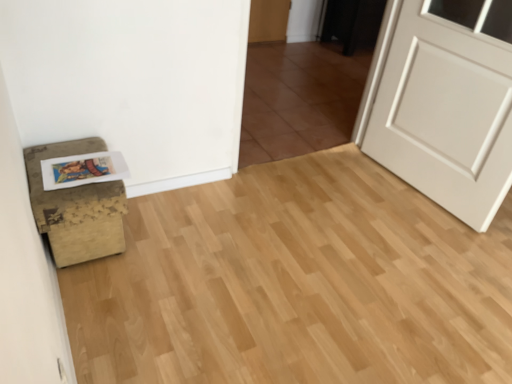
What are the coordinates of `vacant space in front of white matte door at right` in the screenshot? It's located at (420, 249).